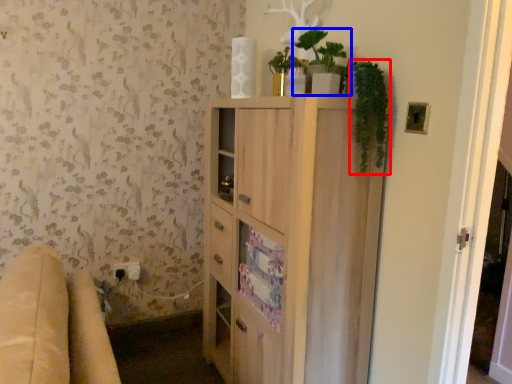
Question: Which object is further to the camera taking this photo, plant (highlighted by a red box) or houseplant (highlighted by a blue box)?

Choices:
 (A) plant
 (B) houseplant

Answer: (B)